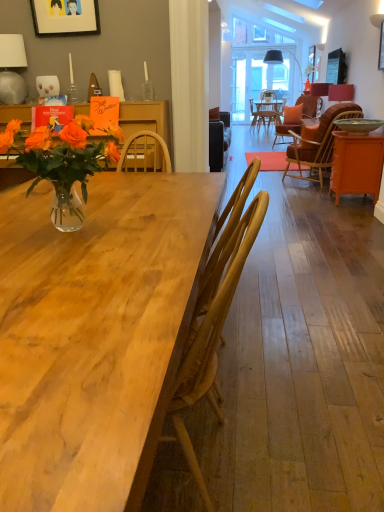
Question: Considering the positions of white ceramic lamp at upper left, arranged as the second lamp when viewed from the right, and wooden picture frame at upper right, which ranks as the second picture frame in front-to-back order, in the image, is white ceramic lamp at upper left, arranged as the second lamp when viewed from the right, taller or shorter than wooden picture frame at upper right, which ranks as the second picture frame in front-to-back order,?

Choices:
 (A) short
 (B) tall

Answer: (B)

Question: Looking at the image, does white ceramic lamp at upper left, which ranks as the second lamp in top-to-bottom order, seem bigger or smaller compared to wooden picture frame at upper right, which is counted as the 1th picture frame, starting from the right?

Choices:
 (A) big
 (B) small

Answer: (A)

Question: Based on their relative distances, which object is farther from the matte red lampshade at upper right, the 2th lamp when ordered from bottom to top?

Choices:
 (A) wooden picture frame at upper right, which ranks as the second picture frame in front-to-back order
 (B) matte black picture frame at upper left, which is the second picture frame from right to left
 (C) orange woven chair at right, which appears as the second chair when ordered from the bottom
 (D) wooden table at center
 (E) wooden chair at center, the second chair from the back

Answer: (D)

Question: Estimate the real-world distances between objects in this image. Which object is closer to the wooden table at center?

Choices:
 (A) wooden picture frame at upper right, which is counted as the 1th picture frame, starting from the right
 (B) orange woven chair at right, marked as the second chair in a left-to-right arrangement
 (C) orange matte cabinet at right
 (D) matte red lampshade at upper right, which ranks as the first lamp in back-to-front order
 (E) white ceramic lamp at upper left, acting as the 2th lamp starting from the back

Answer: (E)